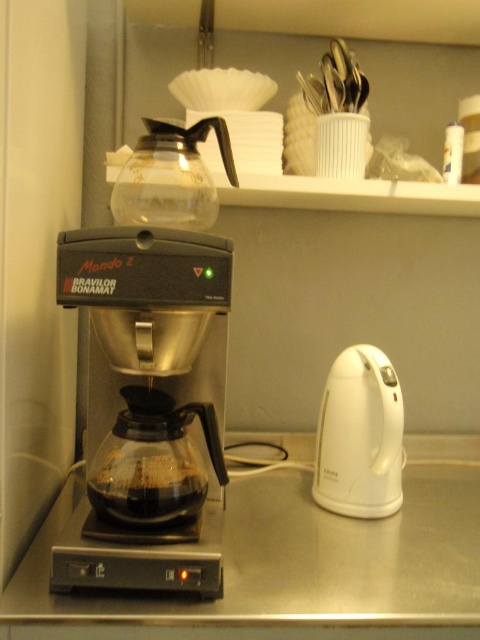
Question: Can you confirm if stainless steel counter at center is positioned to the right of black plastic coffee machine at center?

Choices:
 (A) yes
 (B) no

Answer: (A)

Question: Which object appears closest to the camera in this image?

Choices:
 (A) stainless steel counter at center
 (B) white plastic electric kettle at right
 (C) black plastic coffee machine at center

Answer: (A)

Question: Does black plastic coffee machine at center have a lesser width compared to white plastic electric kettle at right?

Choices:
 (A) yes
 (B) no

Answer: (B)

Question: In this image, where is stainless steel counter at center located relative to white plastic electric kettle at right?

Choices:
 (A) right
 (B) left

Answer: (B)

Question: Which of the following is the farthest from the observer?

Choices:
 (A) black plastic coffee machine at center
 (B) white plastic electric kettle at right

Answer: (B)

Question: Estimate the real-world distances between objects in this image. Which object is closer to the stainless steel counter at center?

Choices:
 (A) black plastic coffee machine at center
 (B) white plastic electric kettle at right

Answer: (B)